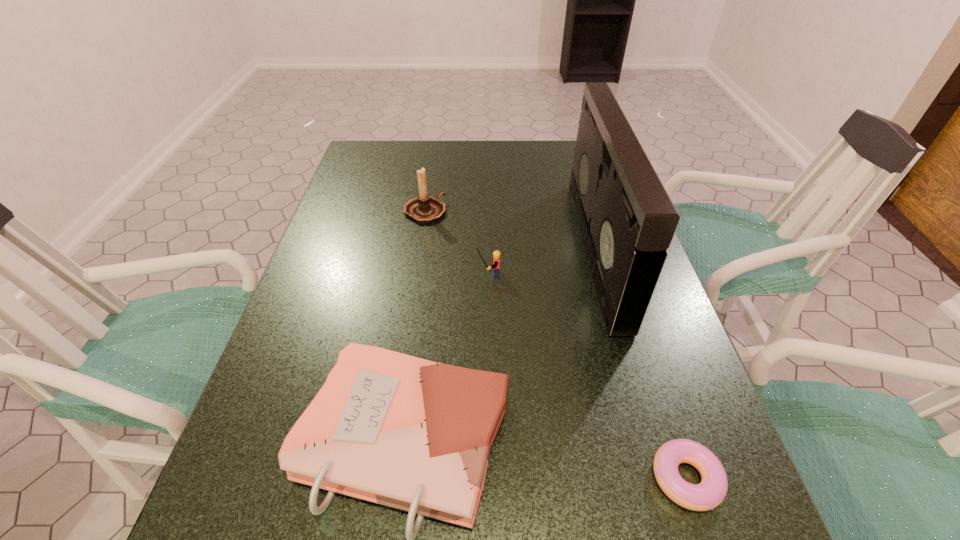
Where is `vacant region that satisfies the following two spatial constraints: 1. on the back side of the shortest object; 2. on the front-facing side of the Lego`? The height and width of the screenshot is (540, 960). vacant region that satisfies the following two spatial constraints: 1. on the back side of the shortest object; 2. on the front-facing side of the Lego is located at coordinates (619, 274).

Identify the location of free location that satisfies the following two spatial constraints: 1. on the back side of the doughnut; 2. on the front side of the videotape. Image resolution: width=960 pixels, height=540 pixels. (611, 249).